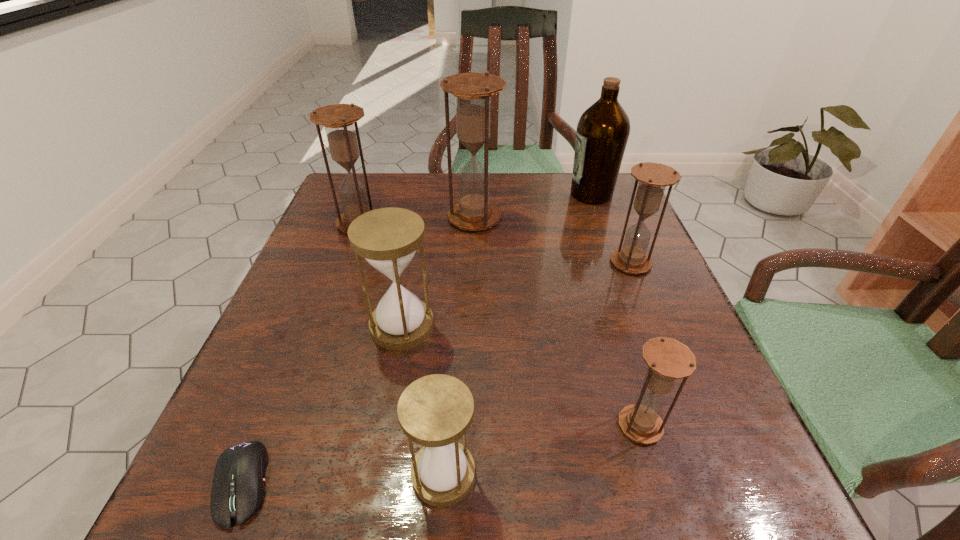
What are the coordinates of `free space between the smaller white hourglass and the fourth farthest object` in the screenshot? It's located at (537, 368).

I want to click on free area in between the olive oil and the smaller white hourglass, so click(x=517, y=334).

This screenshot has height=540, width=960. I want to click on free spot between the black computer equipment and the smaller white hourglass, so pyautogui.click(x=343, y=478).

Image resolution: width=960 pixels, height=540 pixels. Identify the location of vacant space that is in between the smaller white hourglass and the nearest brown hourglass. (541, 450).

Locate an element on the screen. free point between the farther white hourglass and the nearest brown hourglass is located at coordinates (521, 376).

Identify the location of free area in between the biggest brown hourglass and the second smallest brown hourglass. Image resolution: width=960 pixels, height=540 pixels. (552, 240).

At what (x,y) coordinates should I click in order to perform the action: click on blank region between the second brown hourglass from left to right and the brown olive oil. Please return your answer as a coordinate pair (x, y). Image resolution: width=960 pixels, height=540 pixels. Looking at the image, I should click on (533, 206).

Identify the location of free space between the shortest object and the nearer white hourglass. (343, 478).

The height and width of the screenshot is (540, 960). What are the coordinates of `object that is the fifth closest one to the smaller white hourglass` in the screenshot? It's located at (472, 91).

At what (x,y) coordinates should I click in order to perform the action: click on the fourth closest object relative to the third brown hourglass from left to right. Please return your answer as a coordinate pair (x, y). Image resolution: width=960 pixels, height=540 pixels. Looking at the image, I should click on (472, 91).